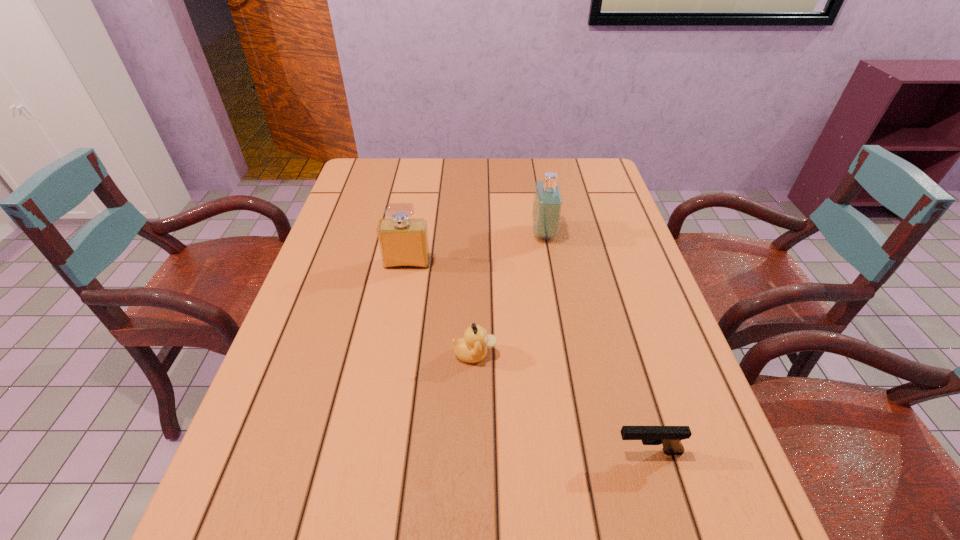
The image size is (960, 540). In order to click on free location at the right edge in this screenshot , I will do `click(635, 255)`.

In the image, there is a desktop. Where is `vacant space at the far left corner`? The height and width of the screenshot is (540, 960). vacant space at the far left corner is located at coordinates (354, 172).

In the image, there is a desktop. Where is `free region at the far right corner`? free region at the far right corner is located at coordinates (589, 179).

At what (x,y) coordinates should I click in order to perform the action: click on free spot between the second object from right to left and the pistol. Please return your answer as a coordinate pair (x, y). This screenshot has width=960, height=540. Looking at the image, I should click on (595, 342).

Image resolution: width=960 pixels, height=540 pixels. In order to click on vacant space in between the duckling and the farther perfume in this screenshot , I will do coord(509,294).

The image size is (960, 540). I want to click on free area in between the shortest object and the second farthest object, so click(527, 357).

You are a GUI agent. You are given a task and a screenshot of the screen. Output one action in this format:
    pyautogui.click(x=<x>, y=<y>)
    Task: Click on the vacant region between the second object from right to left and the leftmost object
    The height and width of the screenshot is (540, 960).
    Given the screenshot: What is the action you would take?
    pyautogui.click(x=475, y=248)

Where is `free area in between the rightmost object and the nearer perfume`? The image size is (960, 540). free area in between the rightmost object and the nearer perfume is located at coordinates (527, 357).

What are the coordinates of `unoccupied area between the right perfume and the duckling` in the screenshot? It's located at (509, 294).

Identify the location of free space between the left perfume and the second nearest object. The image size is (960, 540). (441, 309).